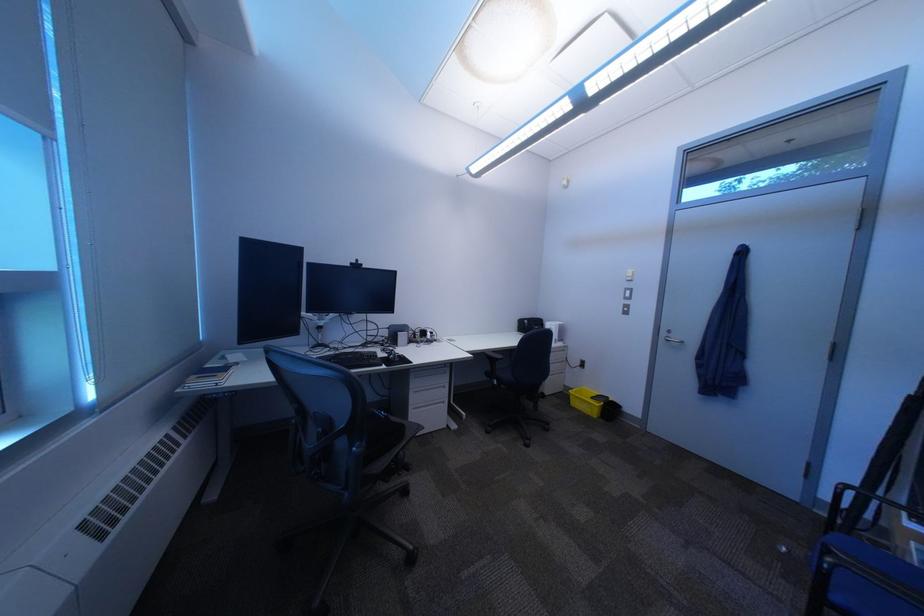
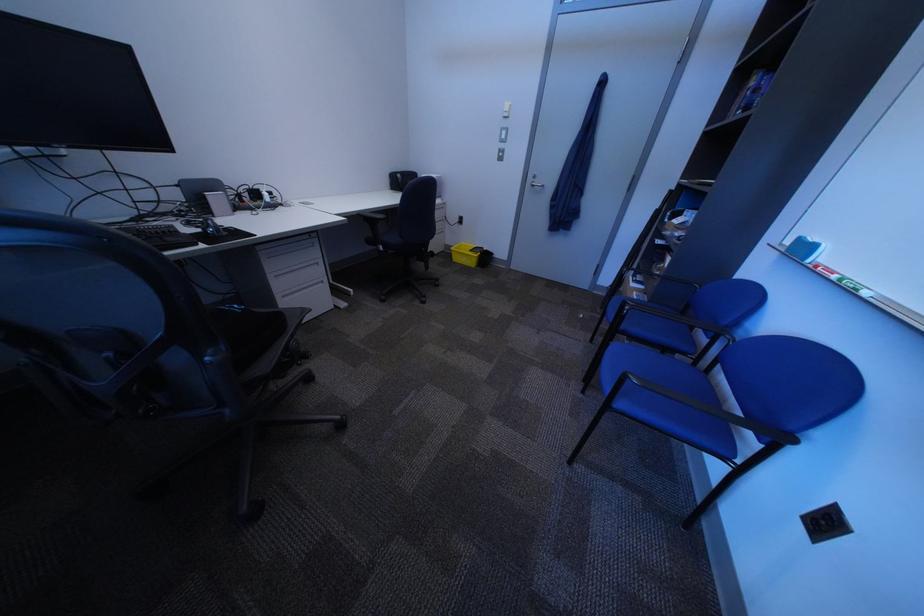
In the second image, find the point that corresponds to pixel 402 358 in the first image.

(214, 232)